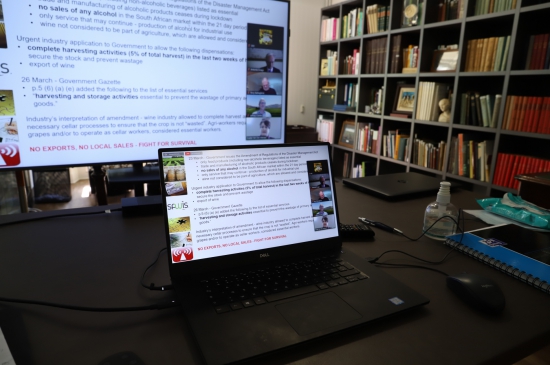
You are a GUI agent. You are given a task and a screenshot of the screen. Output one action in this format:
    pyautogui.click(x=<x>, y=<y>)
    Task: Click on the laptop keyboard
    This screenshot has height=365, width=550.
    Given the screenshot: What is the action you would take?
    pyautogui.click(x=264, y=285)